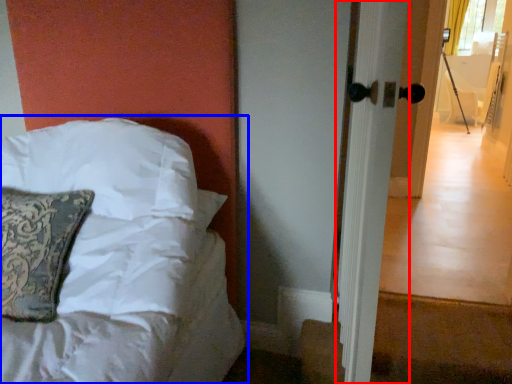
Question: Which object is closer to the camera taking this photo, screen door (highlighted by a red box) or bed (highlighted by a blue box)?

Choices:
 (A) screen door
 (B) bed

Answer: (A)